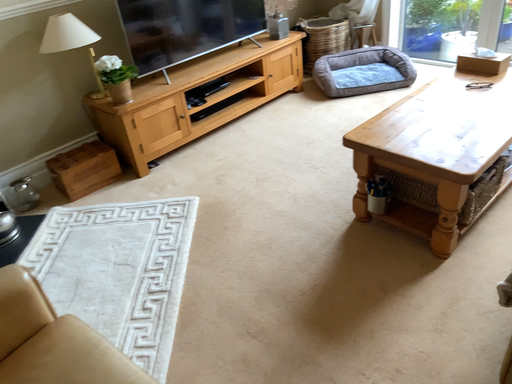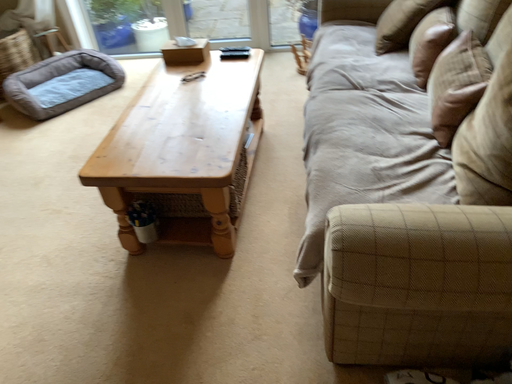
Question: How did the camera likely rotate when shooting the video?

Choices:
 (A) rotated left
 (B) rotated right

Answer: (B)